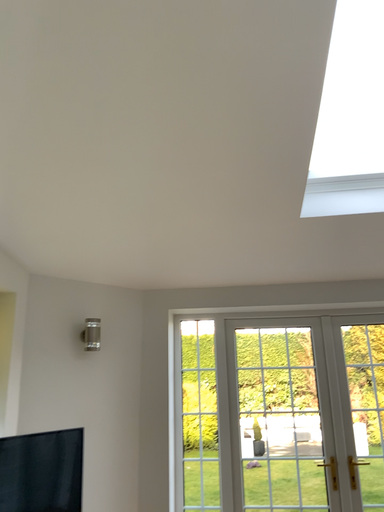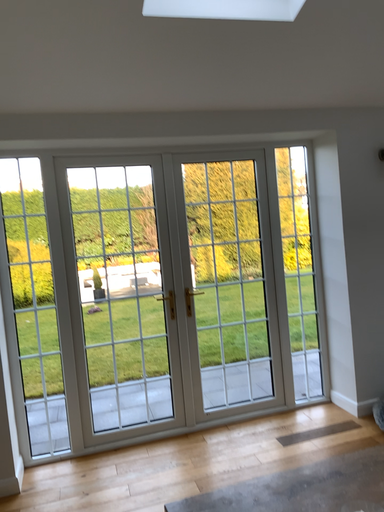
Question: How did the camera likely rotate when shooting the video?

Choices:
 (A) rotated upward
 (B) rotated downward

Answer: (B)